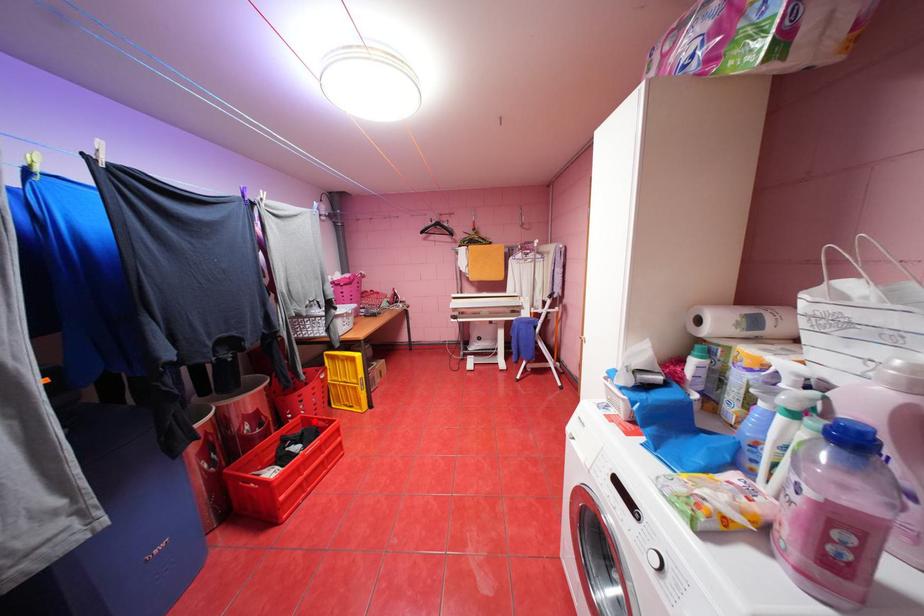
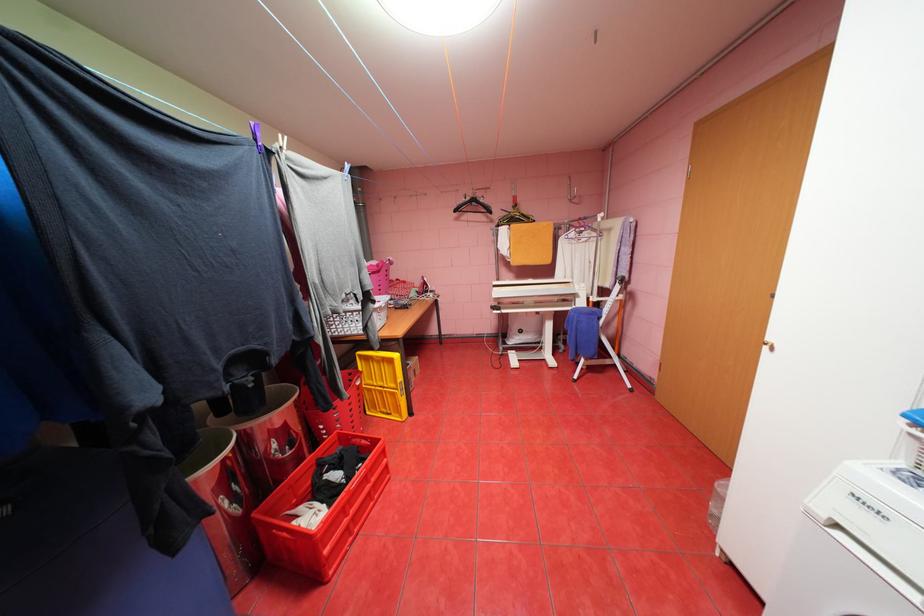
In the second image, find the point that corresponds to the highlighted location in the first image.

(351, 438)